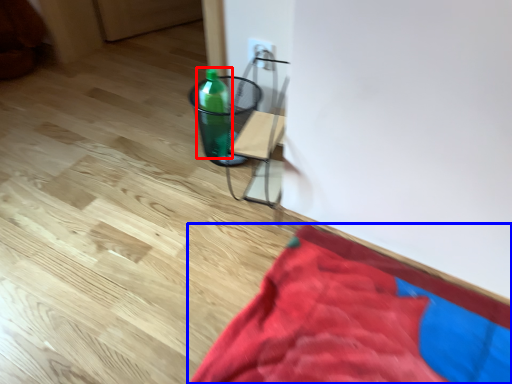
Question: Which object appears closest to the camera in this image, bottle (highlighted by a red box) or blanket (highlighted by a blue box)?

Choices:
 (A) bottle
 (B) blanket

Answer: (B)